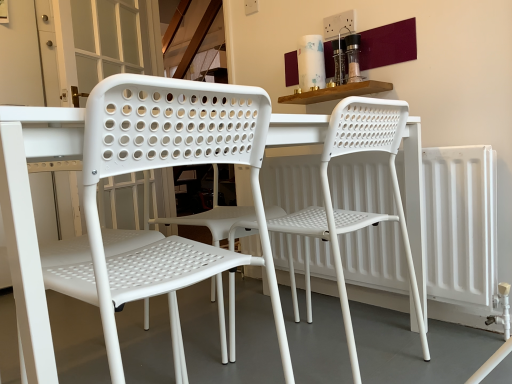
At what (x,y) coordinates should I click in order to perform the action: click on vacant space in front of white matte radiator at right. Please return your answer as a coordinate pair (x, y). Image resolution: width=512 pixels, height=384 pixels. Looking at the image, I should click on (426, 353).